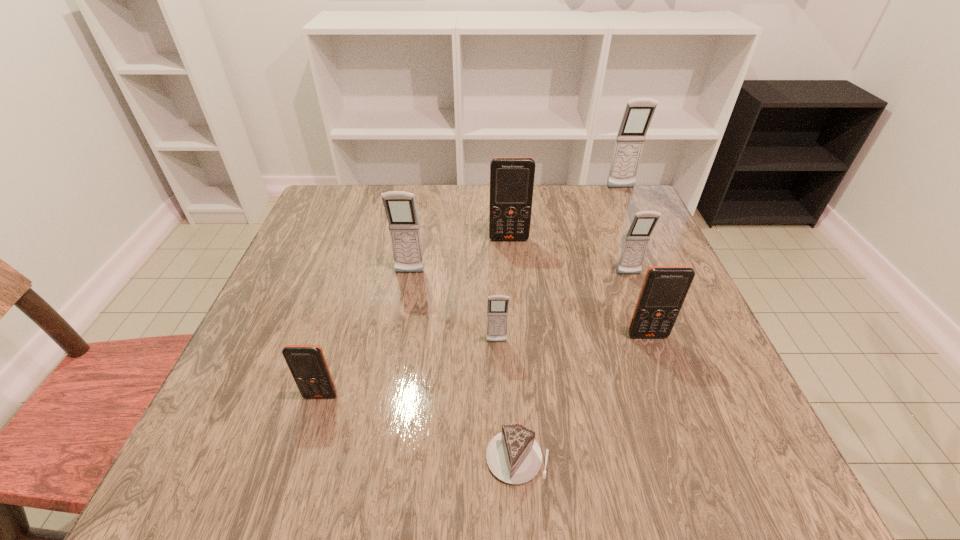
At what (x,y) coordinates should I click in order to perform the action: click on the second nearest object. Please return your answer as a coordinate pair (x, y). This screenshot has width=960, height=540. Looking at the image, I should click on (307, 363).

Where is `the nearest gray cellular telephone`? the nearest gray cellular telephone is located at coordinates pos(497,308).

In order to click on the smallest gray cellular telephone in this screenshot , I will do `click(497, 308)`.

Where is `the shortest object`? the shortest object is located at coordinates (513, 456).

This screenshot has width=960, height=540. I want to click on chocolate cake, so click(x=513, y=456).

Find the location of `free space located 0.050m on the front-facing side of the farthest gray cellular telephone`. free space located 0.050m on the front-facing side of the farthest gray cellular telephone is located at coordinates (626, 200).

Identify the location of vacant space located on the front-facing side of the sixth cellular telephone from right to left. (380, 436).

You are a GUI agent. You are given a task and a screenshot of the screen. Output one action in this format:
    pyautogui.click(x=<x>, y=<y>)
    Task: Click on the vacant space located 0.190m on the screen of the second farthest cellular telephone
    
    Given the screenshot: What is the action you would take?
    pyautogui.click(x=514, y=295)

This screenshot has height=540, width=960. In order to click on vacant space located on the front-facing side of the second gray cellular telephone from right to left in this screenshot , I will do `click(636, 293)`.

The width and height of the screenshot is (960, 540). Identify the location of vacant area situated on the screen of the second farthest orange cellular telephone. (666, 387).